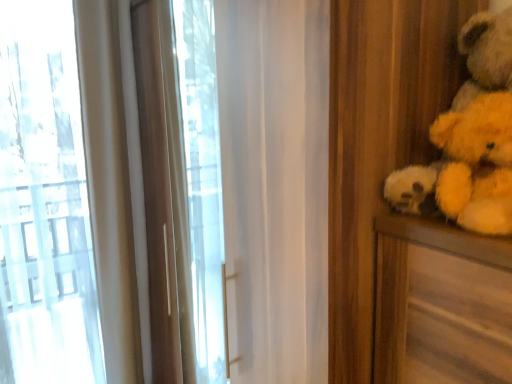
Question: From the image's perspective, is yellow plush bear at right positioned above or below yellow plush teddy bear at right?

Choices:
 (A) below
 (B) above

Answer: (A)

Question: From a real-world perspective, is yellow plush bear at right above or below yellow plush teddy bear at right?

Choices:
 (A) above
 (B) below

Answer: (B)

Question: Relative to yellow plush teddy bear at right, is yellow plush bear at right in front or behind?

Choices:
 (A) front
 (B) behind

Answer: (A)

Question: From a real-world perspective, relative to yellow plush bear at right, is yellow plush teddy bear at right vertically above or below?

Choices:
 (A) below
 (B) above

Answer: (B)

Question: From the image's perspective, is yellow plush teddy bear at right located above or below yellow plush bear at right?

Choices:
 (A) above
 (B) below

Answer: (A)

Question: Would you say yellow plush teddy bear at right is to the left or to the right of yellow plush bear at right in the picture?

Choices:
 (A) right
 (B) left

Answer: (A)

Question: Is yellow plush teddy bear at right taller or shorter than yellow plush bear at right?

Choices:
 (A) tall
 (B) short

Answer: (A)